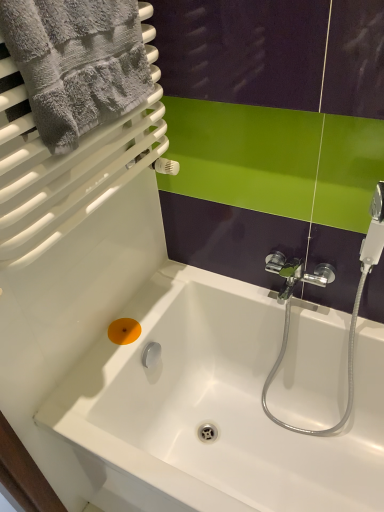
Question: From a real-world perspective, is white glossy bathtub at center on top of gray fluffy towel at upper left?

Choices:
 (A) yes
 (B) no

Answer: (B)

Question: Can you confirm if white glossy bathtub at center is positioned to the left of gray fluffy towel at upper left?

Choices:
 (A) yes
 (B) no

Answer: (B)

Question: Is white glossy bathtub at center located outside gray fluffy towel at upper left?

Choices:
 (A) no
 (B) yes

Answer: (B)

Question: Is white glossy bathtub at center behind gray fluffy towel at upper left?

Choices:
 (A) no
 (B) yes

Answer: (B)

Question: Can you confirm if white glossy bathtub at center is smaller than gray fluffy towel at upper left?

Choices:
 (A) no
 (B) yes

Answer: (A)

Question: Does white glossy bathtub at center appear on the right side of gray fluffy towel at upper left?

Choices:
 (A) yes
 (B) no

Answer: (A)

Question: Considering the relative sizes of orange matte soap at lower left and gray fluffy towel at upper left in the image provided, is orange matte soap at lower left wider than gray fluffy towel at upper left?

Choices:
 (A) no
 (B) yes

Answer: (A)

Question: Is orange matte soap at lower left closer to the viewer compared to gray fluffy towel at upper left?

Choices:
 (A) no
 (B) yes

Answer: (A)

Question: From the image's perspective, is orange matte soap at lower left below gray fluffy towel at upper left?

Choices:
 (A) yes
 (B) no

Answer: (A)

Question: Is the surface of orange matte soap at lower left in direct contact with gray fluffy towel at upper left?

Choices:
 (A) yes
 (B) no

Answer: (B)

Question: Is orange matte soap at lower left turned away from gray fluffy towel at upper left?

Choices:
 (A) yes
 (B) no

Answer: (B)

Question: From a real-world perspective, is orange matte soap at lower left beneath gray fluffy towel at upper left?

Choices:
 (A) no
 (B) yes

Answer: (B)

Question: Is orange matte soap at lower left smaller than white glossy bathtub at center?

Choices:
 (A) no
 (B) yes

Answer: (B)